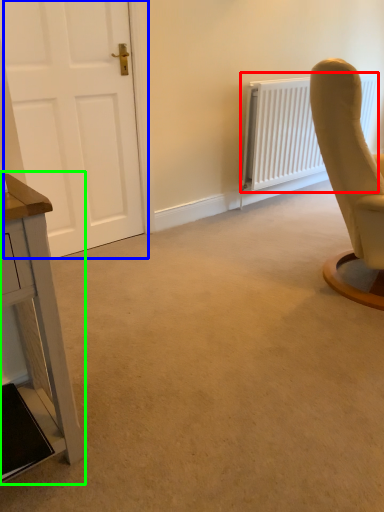
Question: Which is nearer to the radiator (highlighted by a red box)? door (highlighted by a blue box) or table (highlighted by a green box).

Choices:
 (A) door
 (B) table

Answer: (A)